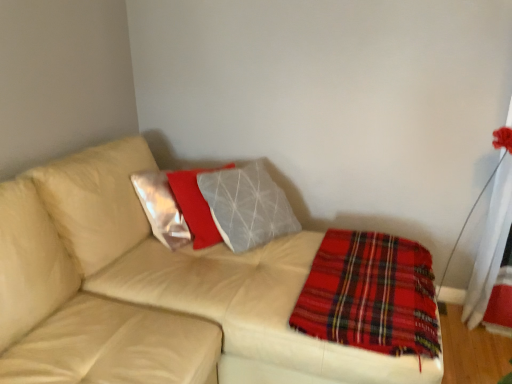
Question: Considering the relative positions of leather couch at center and red plaid blanket at lower right in the image provided, is leather couch at center to the right of red plaid blanket at lower right from the viewer's perspective?

Choices:
 (A) no
 (B) yes

Answer: (A)

Question: Does leather couch at center have a larger size compared to red plaid blanket at lower right?

Choices:
 (A) no
 (B) yes

Answer: (B)

Question: Considering the relative sizes of leather couch at center and red plaid blanket at lower right in the image provided, is leather couch at center shorter than red plaid blanket at lower right?

Choices:
 (A) no
 (B) yes

Answer: (A)

Question: From a real-world perspective, is leather couch at center beneath red plaid blanket at lower right?

Choices:
 (A) yes
 (B) no

Answer: (A)

Question: Is leather couch at center thinner than red plaid blanket at lower right?

Choices:
 (A) no
 (B) yes

Answer: (A)

Question: Considering the relative sizes of leather couch at center and red plaid blanket at lower right in the image provided, is leather couch at center wider than red plaid blanket at lower right?

Choices:
 (A) no
 (B) yes

Answer: (B)

Question: Can leather couch at center be found inside red plaid blanket at lower right?

Choices:
 (A) yes
 (B) no

Answer: (B)

Question: Is red plaid blanket at lower right beside leather couch at center?

Choices:
 (A) no
 (B) yes

Answer: (A)

Question: Considering the relative positions of red plaid blanket at lower right and leather couch at center in the image provided, is red plaid blanket at lower right to the left of leather couch at center from the viewer's perspective?

Choices:
 (A) yes
 (B) no

Answer: (B)

Question: Does red plaid blanket at lower right have a lesser width compared to leather couch at center?

Choices:
 (A) yes
 (B) no

Answer: (A)

Question: Considering the relative positions of red plaid blanket at lower right and leather couch at center in the image provided, is red plaid blanket at lower right to the right of leather couch at center from the viewer's perspective?

Choices:
 (A) yes
 (B) no

Answer: (A)

Question: Does red plaid blanket at lower right have a smaller size compared to leather couch at center?

Choices:
 (A) yes
 (B) no

Answer: (A)

Question: Considering the positions of leather couch at center and red plaid blanket at lower right in the image, is leather couch at center wider or thinner than red plaid blanket at lower right?

Choices:
 (A) thin
 (B) wide

Answer: (B)